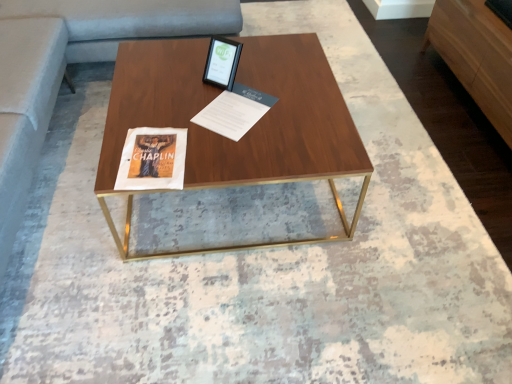
What is the approximate width of matte black tablet at upper center?

4.31 inches.

The height and width of the screenshot is (384, 512). Describe the element at coordinates (247, 132) in the screenshot. I see `walnut wood coffee table at center` at that location.

What do you see at coordinates (234, 111) in the screenshot? I see `white paper at center` at bounding box center [234, 111].

This screenshot has width=512, height=384. What are the coordinates of `light brown wood dresser at right` in the screenshot? It's located at (x=476, y=55).

From a real-world perspective, is light brown wood dresser at right above or below white paper at center?

Clearly, from a real-world perspective, light brown wood dresser at right is below white paper at center.

Is light brown wood dresser at right directly adjacent to white paper at center?

No, light brown wood dresser at right is not touching white paper at center.

Looking at this image, does light brown wood dresser at right have a greater width compared to white paper at center?

Indeed, light brown wood dresser at right has a greater width compared to white paper at center.

Considering their positions, is light brown wood dresser at right located in front of or behind white paper at center?

Clearly, light brown wood dresser at right is behind white paper at center.

Is matte black tablet at upper center in front of or behind white paper at center in the image?

In the image, matte black tablet at upper center appears behind white paper at center.

From the image's perspective, is matte black tablet at upper center located beneath white paper at center?

No, from the image's perspective, matte black tablet at upper center is not below white paper at center.

Are matte black tablet at upper center and white paper at center located far from each other?

No, there isn't a large distance between matte black tablet at upper center and white paper at center.

Considering the relative sizes of matte black tablet at upper center and walnut wood coffee table at center in the image provided, is matte black tablet at upper center thinner than walnut wood coffee table at center?

Indeed, matte black tablet at upper center has a lesser width compared to walnut wood coffee table at center.

From a real-world perspective, does matte black tablet at upper center stand above walnut wood coffee table at center?

Yes, from a real-world perspective, matte black tablet at upper center is above walnut wood coffee table at center.

Is matte black tablet at upper center located outside walnut wood coffee table at center?

Yes.

Considering the sizes of objects walnut wood coffee table at center and white paper at center in the image provided, who is thinner, walnut wood coffee table at center or white paper at center?

white paper at center.

From a real-world perspective, does walnut wood coffee table at center sit lower than white paper at center?

Yes.

Is point (140, 70) positioned before point (225, 92)?

No, it is behind (225, 92).

Find the location of `magazine on the right of walnut wood coffee table at center`. magazine on the right of walnut wood coffee table at center is located at coordinates (234, 111).

Visually, is light brown wood dresser at right positioned to the left or to the right of walnut wood coffee table at center?

Based on their positions, light brown wood dresser at right is located to the right of walnut wood coffee table at center.

Locate an element on the screen. The width and height of the screenshot is (512, 384). coffee table beneath the light brown wood dresser at right (from a real-world perspective) is located at coordinates (247, 132).

Considering the sizes of light brown wood dresser at right and walnut wood coffee table at center in the image, is light brown wood dresser at right wider or thinner than walnut wood coffee table at center?

light brown wood dresser at right is thinner than walnut wood coffee table at center.

Which is behind, point (249, 96) or point (207, 81)?

Positioned behind is point (207, 81).

Consider the image. Considering the sizes of objects white paper at center and matte black tablet at upper center in the image provided, who is wider, white paper at center or matte black tablet at upper center?

white paper at center is wider.

Is white paper at center aimed at matte black tablet at upper center?

No, white paper at center is not oriented towards matte black tablet at upper center.

From a real-world perspective, is white paper at center under walnut wood coffee table at center?

No, from a real-world perspective, white paper at center is not beneath walnut wood coffee table at center.

Is white paper at center oriented away from walnut wood coffee table at center?

Yes, white paper at center is positioned with its back facing walnut wood coffee table at center.

Is white paper at center inside the boundaries of walnut wood coffee table at center, or outside?

white paper at center fits inside walnut wood coffee table at center.

Where is `magazine below the light brown wood dresser at right (from the image's perspective)`? The width and height of the screenshot is (512, 384). magazine below the light brown wood dresser at right (from the image's perspective) is located at coordinates [234, 111].

Where is `tablet computer that appears on the left of white paper at center`? The image size is (512, 384). tablet computer that appears on the left of white paper at center is located at coordinates (222, 62).

From the image, which object appears to be farther from light brown wood dresser at right, walnut wood coffee table at center or matte black tablet at upper center?

matte black tablet at upper center lies further to light brown wood dresser at right than the other object.

From the image, which object appears to be farther from walnut wood coffee table at center, light brown wood dresser at right or matte black tablet at upper center?

Based on the image, light brown wood dresser at right appears to be further to walnut wood coffee table at center.

From the picture: From the image, which object appears to be farther from white paper at center, walnut wood coffee table at center or light brown wood dresser at right?

light brown wood dresser at right lies further to white paper at center than the other object.

Consider the image. Based on their spatial positions, is light brown wood dresser at right or walnut wood coffee table at center closer to matte black tablet at upper center?

Based on the image, walnut wood coffee table at center appears to be nearer to matte black tablet at upper center.

Based on their spatial positions, is matte black tablet at upper center or white paper at center closer to walnut wood coffee table at center?

The object closer to walnut wood coffee table at center is white paper at center.

Consider the image. Estimate the real-world distances between objects in this image. Which object is further from matte black tablet at upper center, white paper at center or light brown wood dresser at right?

light brown wood dresser at right lies further to matte black tablet at upper center than the other object.

Considering their positions, is walnut wood coffee table at center positioned closer to light brown wood dresser at right than white paper at center?

Among the two, walnut wood coffee table at center is located nearer to light brown wood dresser at right.

Which object lies further to the anchor point matte black tablet at upper center, white paper at center or walnut wood coffee table at center?

walnut wood coffee table at center lies further to matte black tablet at upper center than the other object.

This screenshot has height=384, width=512. In order to click on coffee table between matte black tablet at upper center and light brown wood dresser at right from left to right in this screenshot , I will do `click(247, 132)`.

Locate an element on the screen. This screenshot has height=384, width=512. magazine located between walnut wood coffee table at center and light brown wood dresser at right in the left-right direction is located at coordinates (234, 111).

Image resolution: width=512 pixels, height=384 pixels. I want to click on magazine between matte black tablet at upper center and walnut wood coffee table at center in the vertical direction, so click(234, 111).

In order to click on magazine located between matte black tablet at upper center and light brown wood dresser at right in the left-right direction in this screenshot , I will do 234,111.